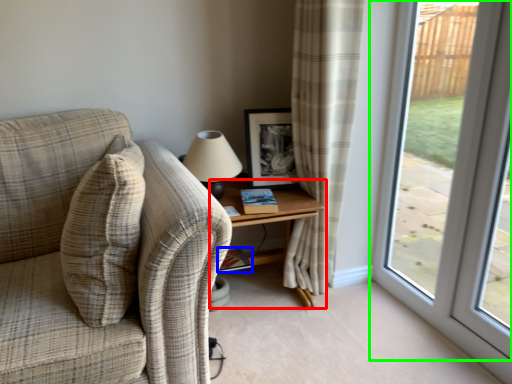
Question: Considering the real-world distances, which object is farthest from table (highlighted by a red box)? book (highlighted by a blue box) or window (highlighted by a green box)?

Choices:
 (A) book
 (B) window

Answer: (B)